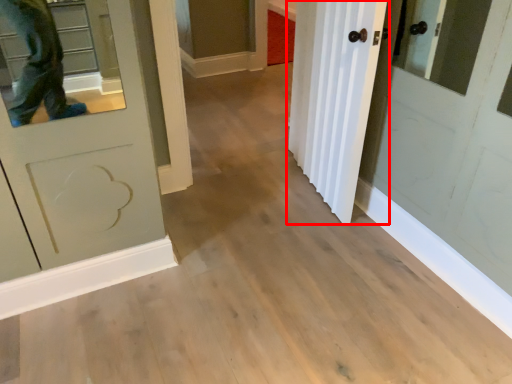
Question: From the image's perspective, where is door (annotated by the red box) located relative to cabinetry?

Choices:
 (A) below
 (B) above

Answer: (A)